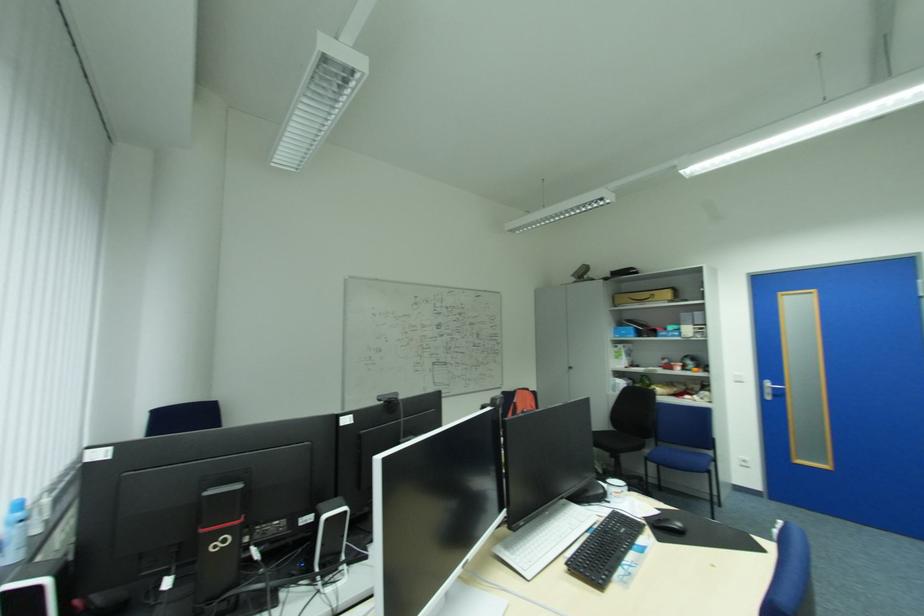
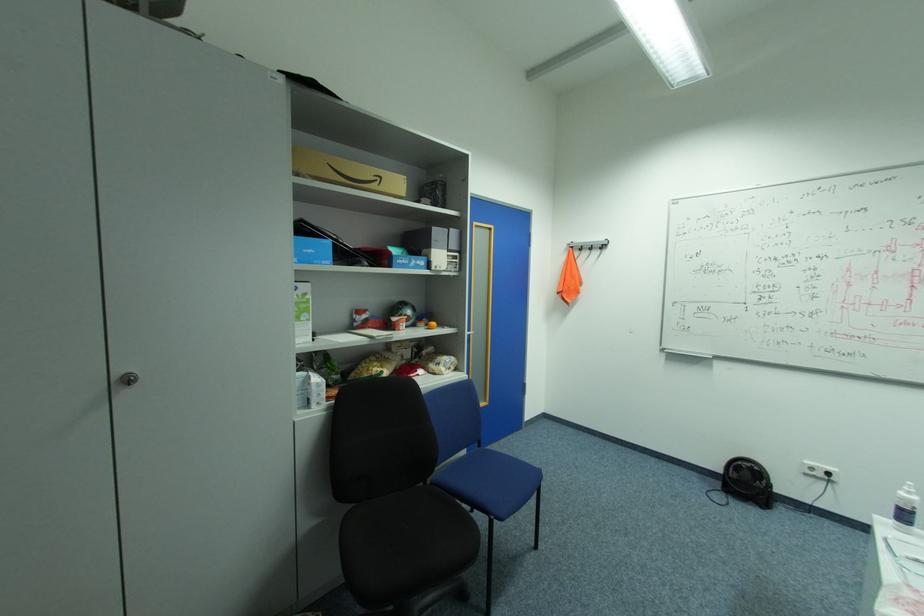
Locate, in the second image, the point that corresponds to (x=672, y=384) in the first image.

(380, 358)